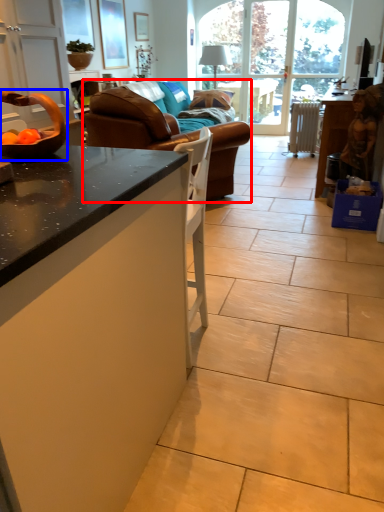
Question: Which point is closer to the camera, studio couch (highlighted by a red box) or bowl (highlighted by a blue box)?

Choices:
 (A) studio couch
 (B) bowl

Answer: (B)